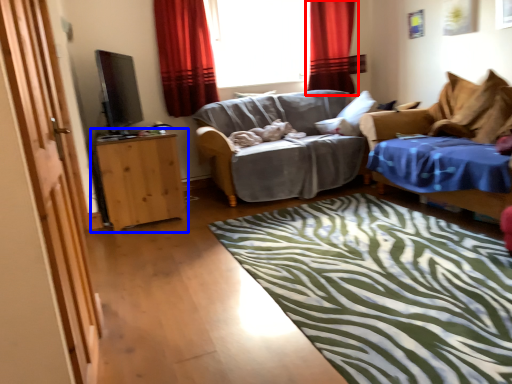
Question: Which of the following is the closest to the observer, curtain (highlighted by a red box) or table (highlighted by a blue box)?

Choices:
 (A) curtain
 (B) table

Answer: (B)